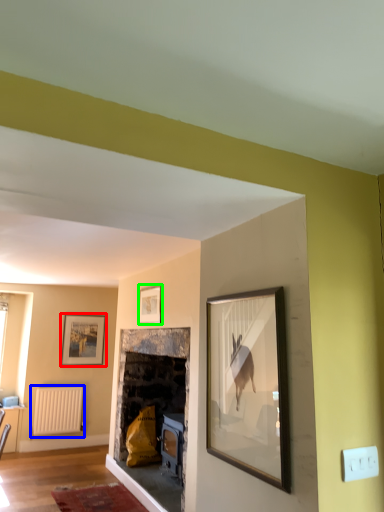
Question: Which object is the farthest from picture frame (highlighted by a red box)? Choose among these: radiator (highlighted by a blue box) or picture frame (highlighted by a green box).

Choices:
 (A) radiator
 (B) picture frame

Answer: (B)